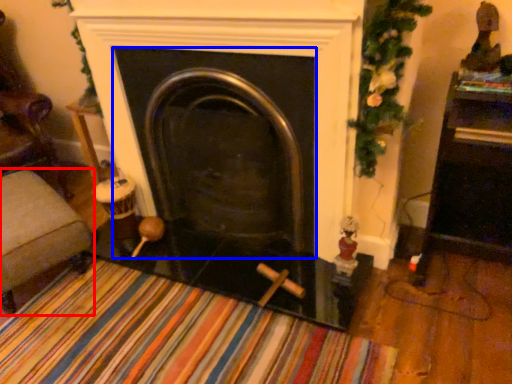
Question: Which of the following is the closest to the observer, furniture (highlighted by a red box) or fireplace (highlighted by a blue box)?

Choices:
 (A) furniture
 (B) fireplace

Answer: (B)